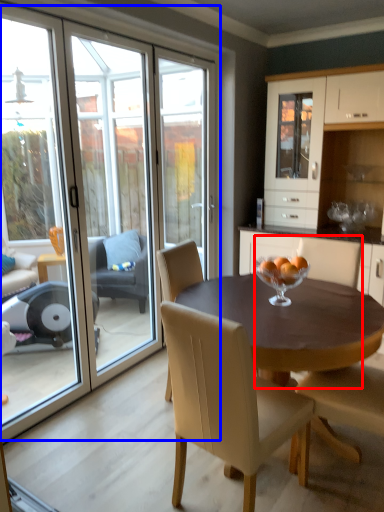
Question: Which object is further to the camera taking this photo, chair (highlighted by a red box) or glass door (highlighted by a blue box)?

Choices:
 (A) chair
 (B) glass door

Answer: (A)